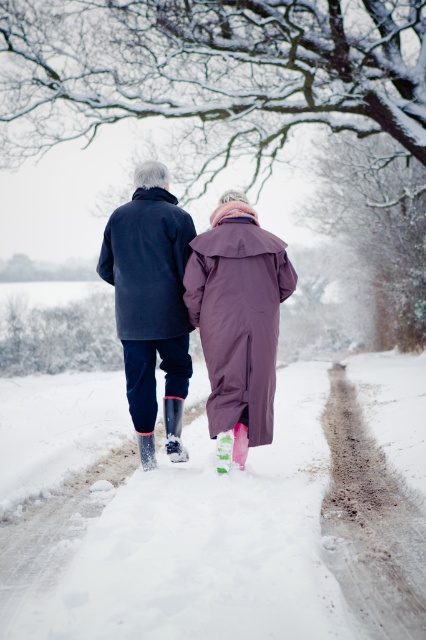
Who is positioned more to the left, matte black coat at center or purple waterproof coat at center?

Positioned to the left is matte black coat at center.

Does matte black coat at center have a greater width compared to purple waterproof coat at center?

Yes, matte black coat at center is wider than purple waterproof coat at center.

Who is more forward, [198,257] or [236,224]?

Point [198,257]

This screenshot has height=640, width=426. Find the location of `matte black coat at center`. matte black coat at center is located at coordinates (150, 298).

Can you confirm if purple waterproof coat at center is thinner than dark blue wool coat at center?

In fact, purple waterproof coat at center might be wider than dark blue wool coat at center.

I want to click on purple waterproof coat at center, so click(238, 316).

Does matte black coat at center come in front of dark blue wool coat at center?

Yes.

Who is more distant from viewer, (152, 467) or (173, 314)?

Point (152, 467)

Is point (235, 236) in front of point (135, 320)?

Yes, it is in front of point (135, 320).

In order to click on matte black coat at center in this screenshot , I will do `click(150, 298)`.